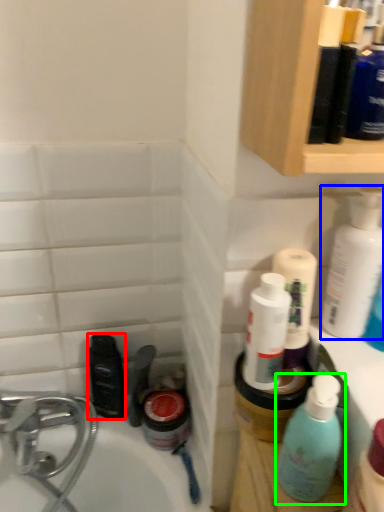
Question: Which object is positioned closest to mouthwash (highlighted by a red box)? Select from cleaning product (highlighted by a blue box) and bottle (highlighted by a green box).

Choices:
 (A) cleaning product
 (B) bottle

Answer: (B)